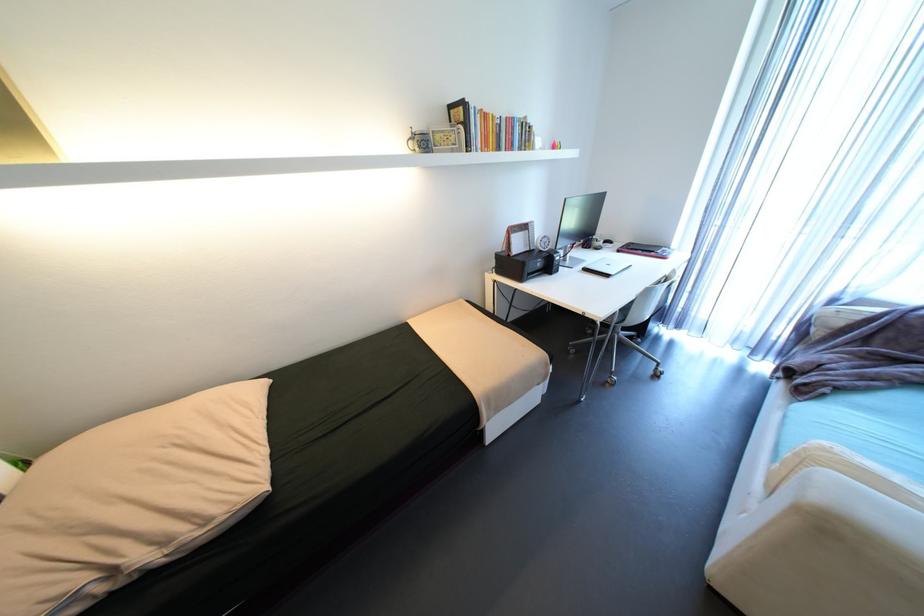
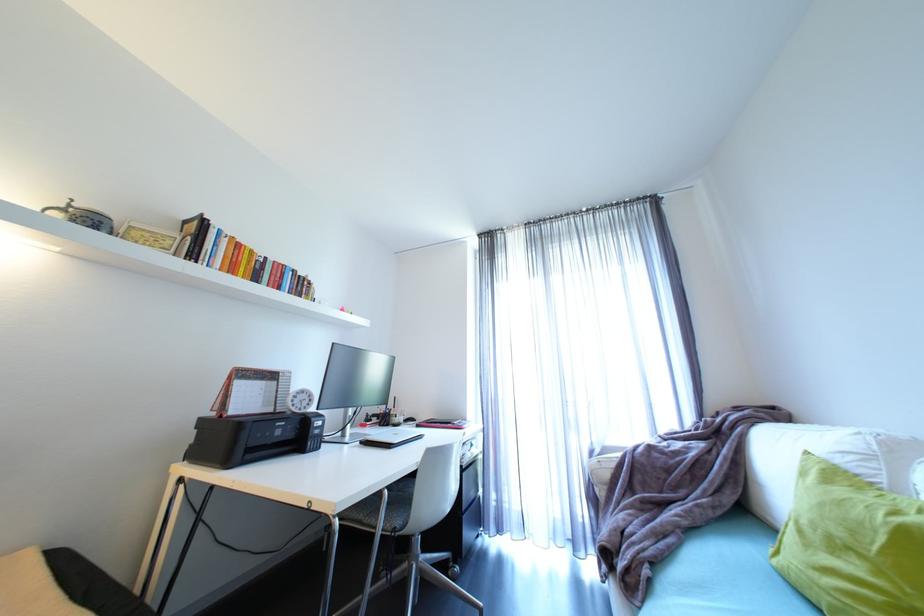
In the second image, find the point that corresponds to the point at 660,252 in the first image.

(457, 424)